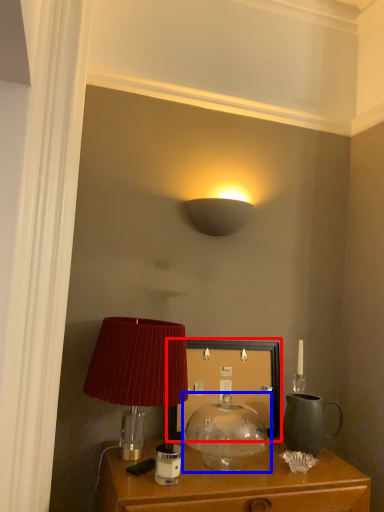
Question: Which point is further to the camera, picture frame (highlighted by a red box) or lamp (highlighted by a blue box)?

Choices:
 (A) picture frame
 (B) lamp

Answer: (A)